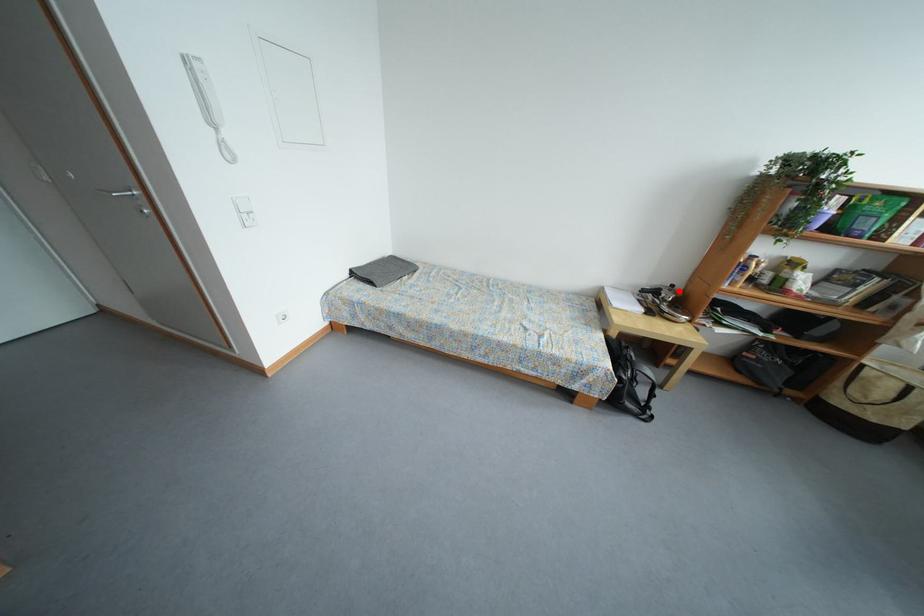
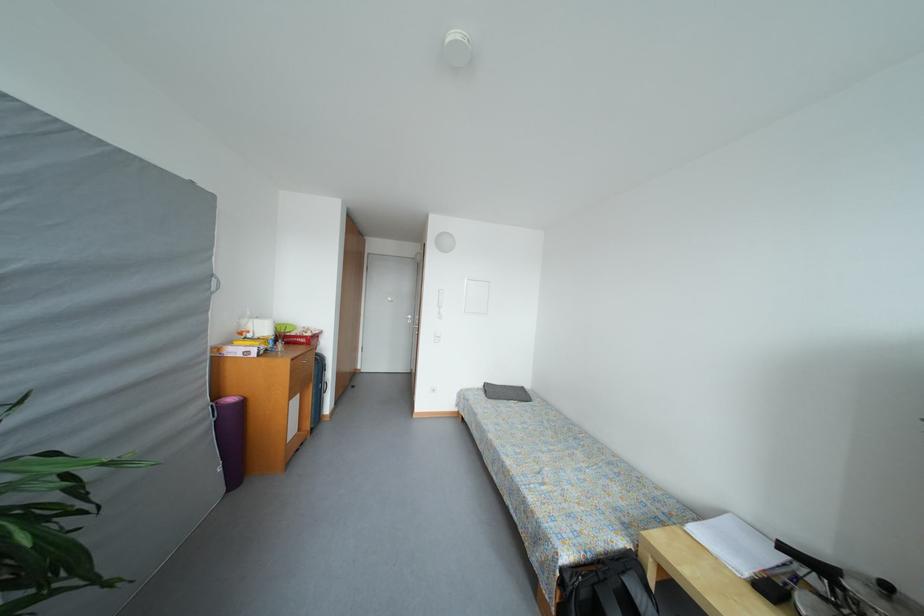
Question: I am providing you with two images of the same scene from different viewpoints. In image1, a red point is highlighted. Considering the same 3D point in image2, which of the following is correct?

Choices:
 (A) It is closer
 (B) It is farther

Answer: (B)